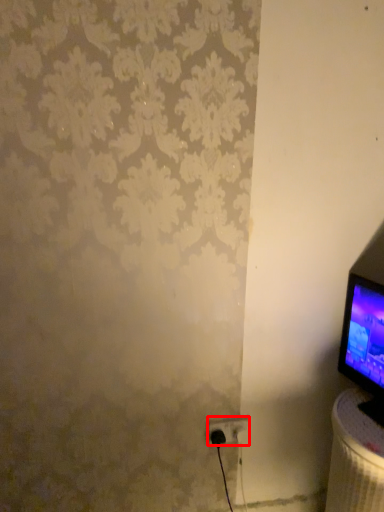
Question: From the image's perspective, where is power plugs and sockets (annotated by the red box) located relative to table?

Choices:
 (A) below
 (B) above

Answer: (B)